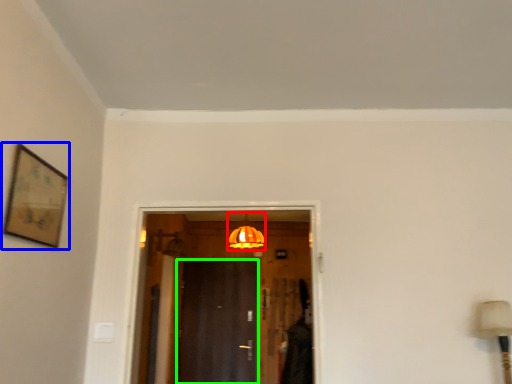
Question: Which object is positioned closest to light fixture (highlighted by a red box)? Select from picture frame (highlighted by a blue box) and door (highlighted by a green box).

Choices:
 (A) picture frame
 (B) door

Answer: (B)